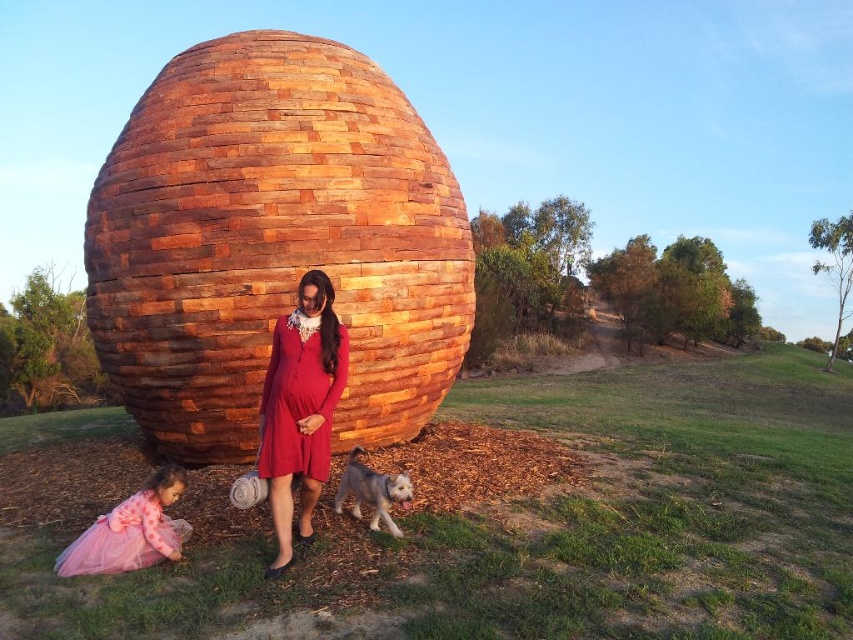
You are standing at the point with coordinates (300, 408) in the image. What object is located at this point?

The point at coordinates (300, 408) is occupied by the matte red dress at center.

You are standing in front of the large wooden sculpture and see the matte red dress at center and the pink tulle dress at lower left. Which one is positioned more to the left?

The pink tulle dress at lower left is positioned more to the left than the matte red dress at center.